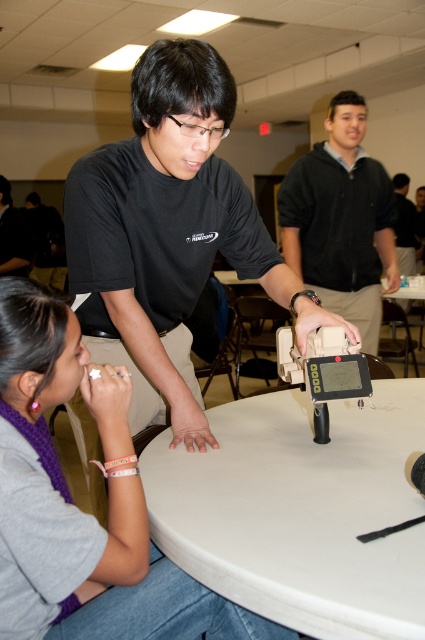
Question: Which point appears farthest from the camera in this image?

Choices:
 (A) (28, 291)
 (B) (404, 192)

Answer: (B)

Question: Can you confirm if matte black shirt at center is positioned to the right of black matte shirt at upper center?

Choices:
 (A) no
 (B) yes

Answer: (A)

Question: Is white plastic table at center wider than black matte shirt at upper center?

Choices:
 (A) no
 (B) yes

Answer: (B)

Question: Which object is farther from the camera taking this photo?

Choices:
 (A) black matte shirt at upper center
 (B) matte black shirt at center
 (C) white plastic table at center
 (D) gray fabric shirt at lower left

Answer: (A)

Question: Which of these objects is positioned closest to the dark gray hoodie at center?

Choices:
 (A) white plastic table at center
 (B) black matte shirt at upper center

Answer: (A)

Question: Can you confirm if matte black shirt at center is positioned above black matte shirt at upper center?

Choices:
 (A) yes
 (B) no

Answer: (B)